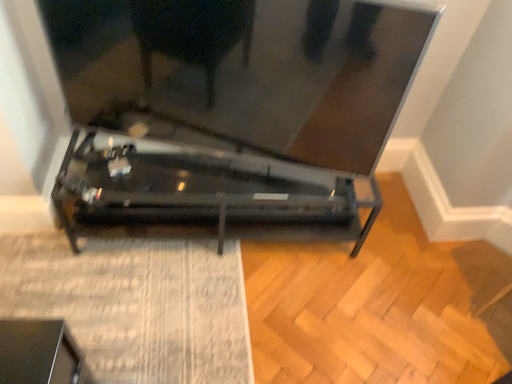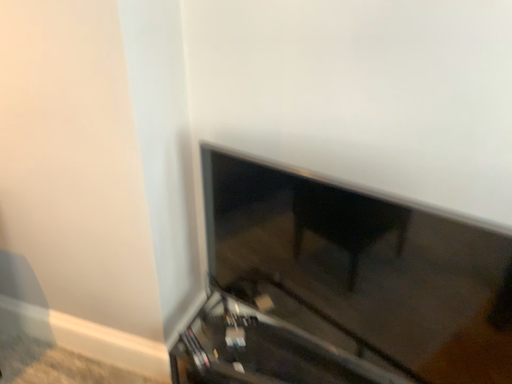
Question: How did the camera likely rotate when shooting the video?

Choices:
 (A) rotated downward
 (B) rotated upward

Answer: (B)